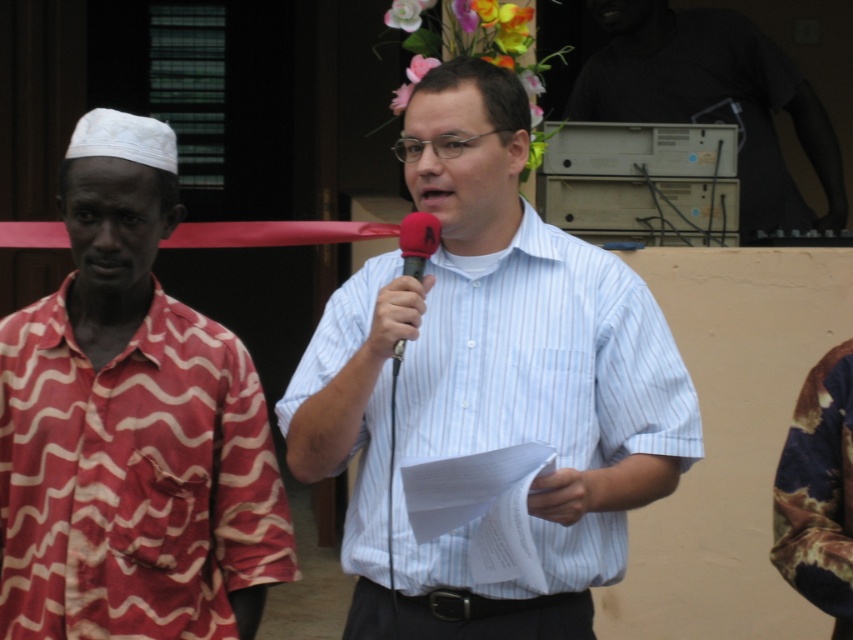
You are standing at the point marked by coordinates point (131,428) in the image. Which object is directly in front of you?

The point marked by coordinates point (131,428) directly faces the wavy fabric shirt at left.

You are a photographer at the event and want to capture a photo of the light blue striped shirt at center without the wavy fabric shirt at left blocking it. How should you adjust your position?

Move to the side so that the light blue striped shirt at center is no longer blocked by the wavy fabric shirt at left since the light blue striped shirt at center is behind the wavy fabric shirt at left.

You are attending a public event and see two items of interest in the scene described. The wavy fabric shirt at left and the red matte microphone at center. Which of these two items is positioned closer to the left side of the image?

The wavy fabric shirt at left is positioned to the left of the red matte microphone at center, so it is closer to the left side of the image.